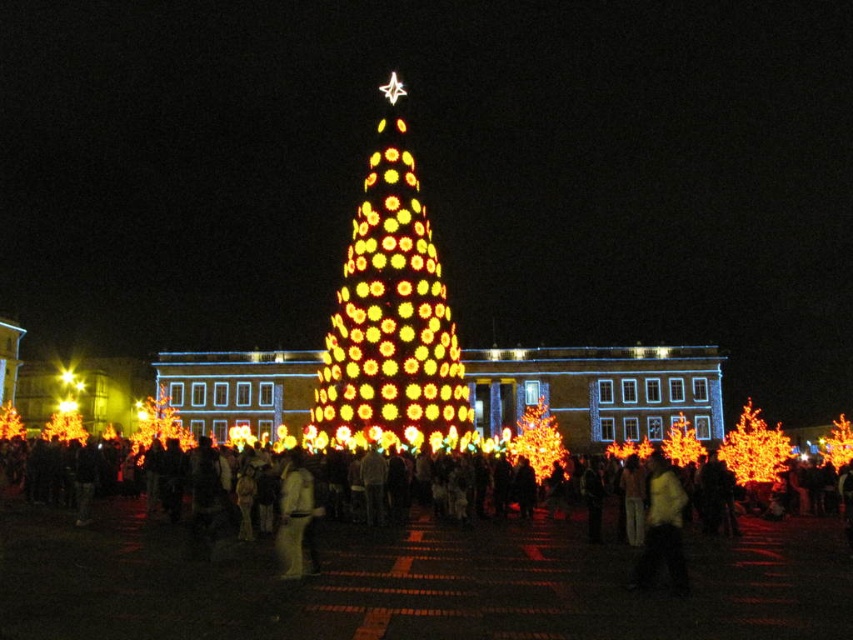
Question: Is yellow fabric jacket at center to the right of light beige sweater at center from the viewer's perspective?

Choices:
 (A) no
 (B) yes

Answer: (B)

Question: Which of the following is the closest to the observer?

Choices:
 (A) (183, 436)
 (B) (439, 464)
 (C) (434, 298)

Answer: (B)

Question: Is yellow fabric jacket at center to the left of light beige sweater at center from the viewer's perspective?

Choices:
 (A) yes
 (B) no

Answer: (B)

Question: Which point is farther to the camera?

Choices:
 (A) (674, 540)
 (B) (287, 540)
 (C) (160, 404)
 (D) (334, 324)

Answer: (C)

Question: Is white cotton shirt at center closer to camera compared to illuminated plastic tree at center?

Choices:
 (A) no
 (B) yes

Answer: (B)

Question: Which object is the closest to the illuminated orange lights at center?

Choices:
 (A) yellow fabric jacket at center
 (B) illuminated orange lights at right

Answer: (A)